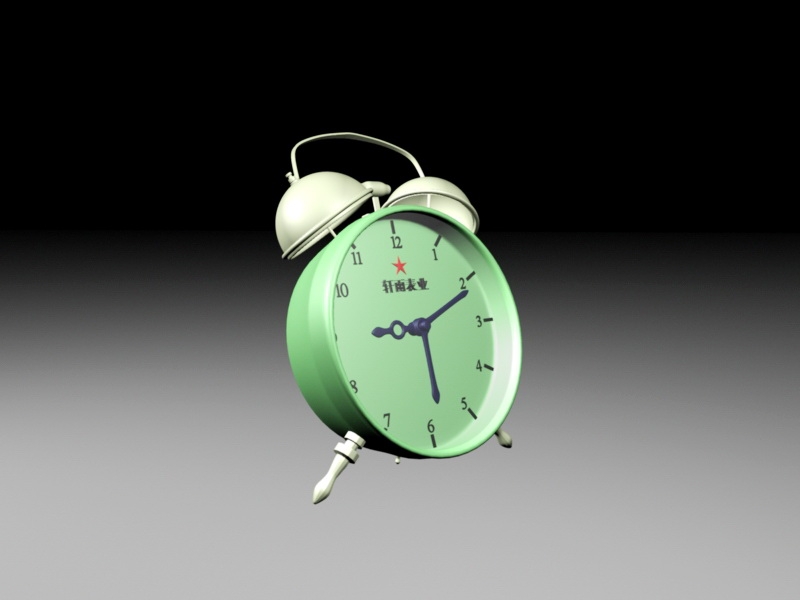
In order to click on alarm clock in this screenshot , I will do `click(401, 320)`.